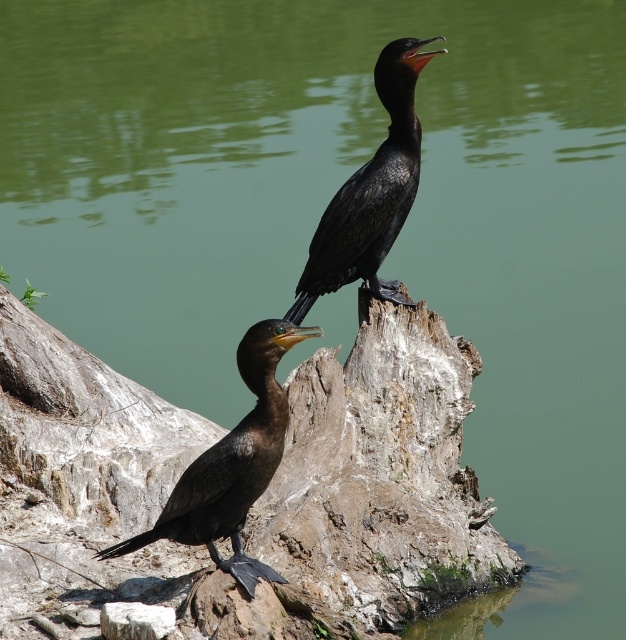
You are standing at a point 25 feet away from the camera. You want to walk towards the point marked as point [116,547]. How many more feet do you need to walk to reach that point?

The distance between point [116,547] and the camera is 20.50 feet. Since you are currently 25 feet away from the camera, you need to walk 25 minus 20.50 equals 4.5 feet less. Wait, that doesn

You are a birdwatcher observing two cormorants on a tree stump near water. You notice a shiny black bird at lower left at point (232,464). Can you confirm if this bird is the one with the open beak showing bright orange interior?

The shiny black bird at lower left at point (232,464) is the cormorant in the foreground with its head turned slightly towards the other bird and a yellowish orange beak with dark tip. The second cormorant positioned further back has its beak open wide revealing bright orange interior. Therefore, the shiny black bird at lower left at point (232,464) is not the one with open beak showing bright orange interior.